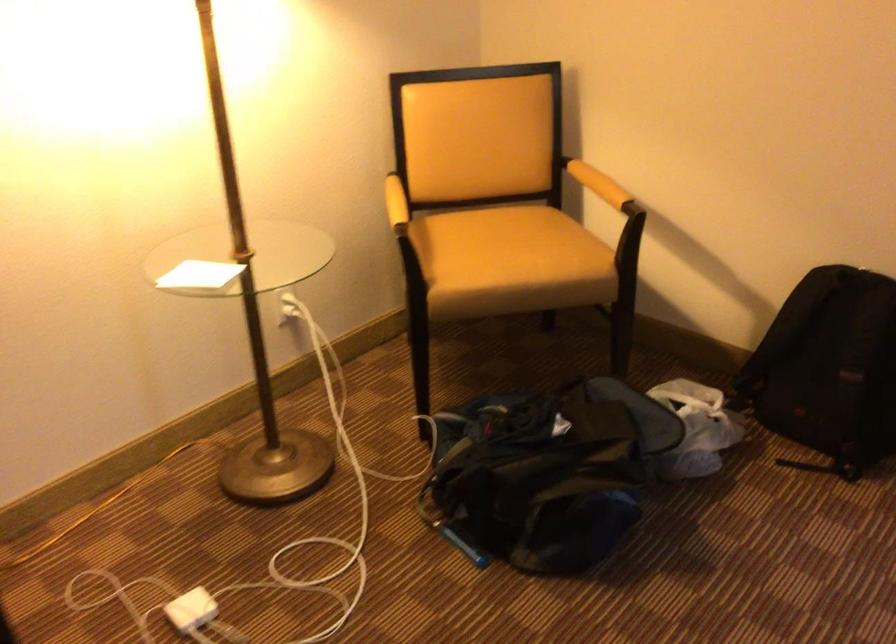
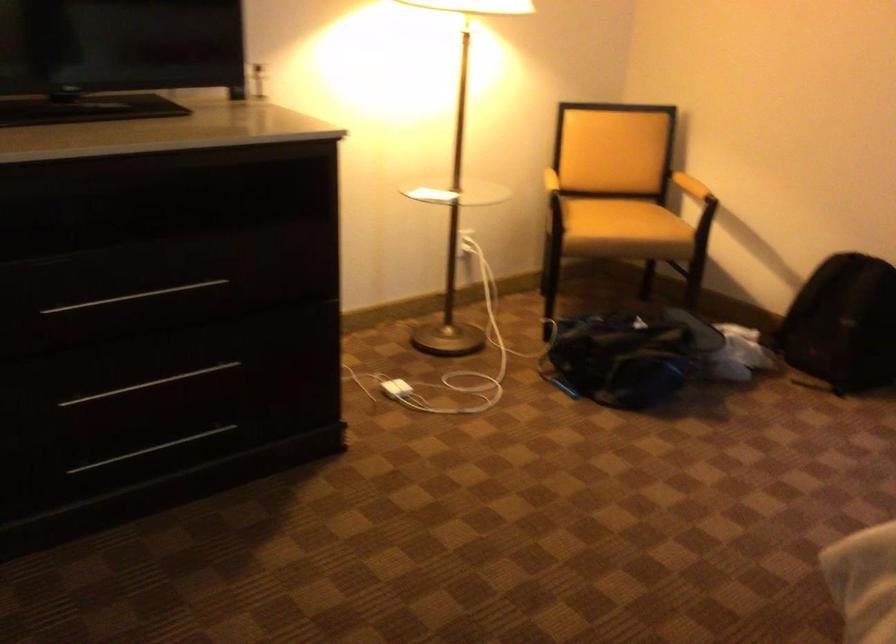
The point at [609,196] is marked in the first image. Where is the corresponding point in the second image?

(690, 185)